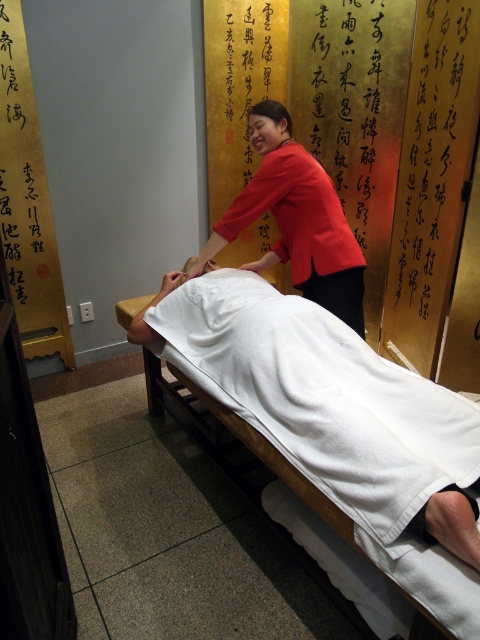
Question: Is white towel-covered bed at center bigger than red smooth blouse at center?

Choices:
 (A) no
 (B) yes

Answer: (B)

Question: Is white towel-covered bed at center smaller than red smooth blouse at center?

Choices:
 (A) no
 (B) yes

Answer: (A)

Question: Which object appears farthest from the camera in this image?

Choices:
 (A) red smooth blouse at center
 (B) white towel-covered bed at center

Answer: (A)

Question: Observing the image, what is the correct spatial positioning of white towel-covered bed at center in reference to red smooth blouse at center?

Choices:
 (A) above
 (B) below

Answer: (B)

Question: Which point is closer to the camera?

Choices:
 (A) red smooth blouse at center
 (B) white towel-covered bed at center

Answer: (B)